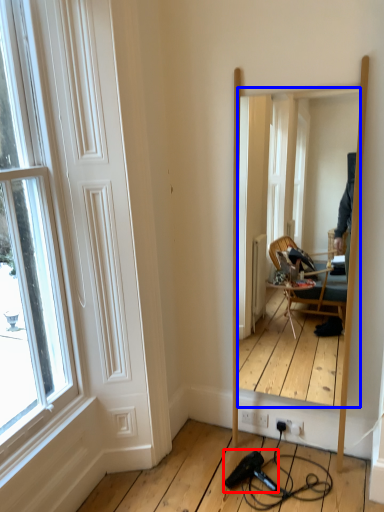
Question: Among these objects, which one is nearest to the camera, hair drier (highlighted by a red box) or mirror (highlighted by a blue box)?

Choices:
 (A) hair drier
 (B) mirror

Answer: (B)